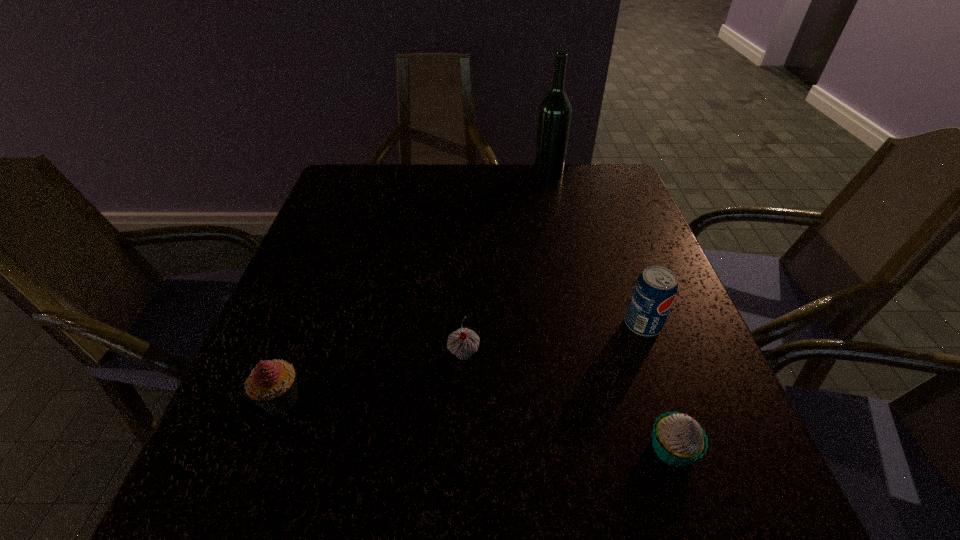
This screenshot has width=960, height=540. I want to click on free space that satisfies the following two spatial constraints: 1. on the front side of the tallest object; 2. on the right side of the fourth shortest object, so click(583, 325).

Where is `free space in the image that satisfies the following two spatial constraints: 1. on the back side of the second nearest cupcake; 2. on the right side of the alcohol`? free space in the image that satisfies the following two spatial constraints: 1. on the back side of the second nearest cupcake; 2. on the right side of the alcohol is located at coordinates (366, 171).

Identify the location of free space that satisfies the following two spatial constraints: 1. on the back side of the rightmost cupcake; 2. on the right side of the fourth shortest object. (x=632, y=325).

Locate an element on the screen. The width and height of the screenshot is (960, 540). free space that satisfies the following two spatial constraints: 1. on the back side of the fourth nearest object; 2. on the right side of the third farthest object is located at coordinates (465, 325).